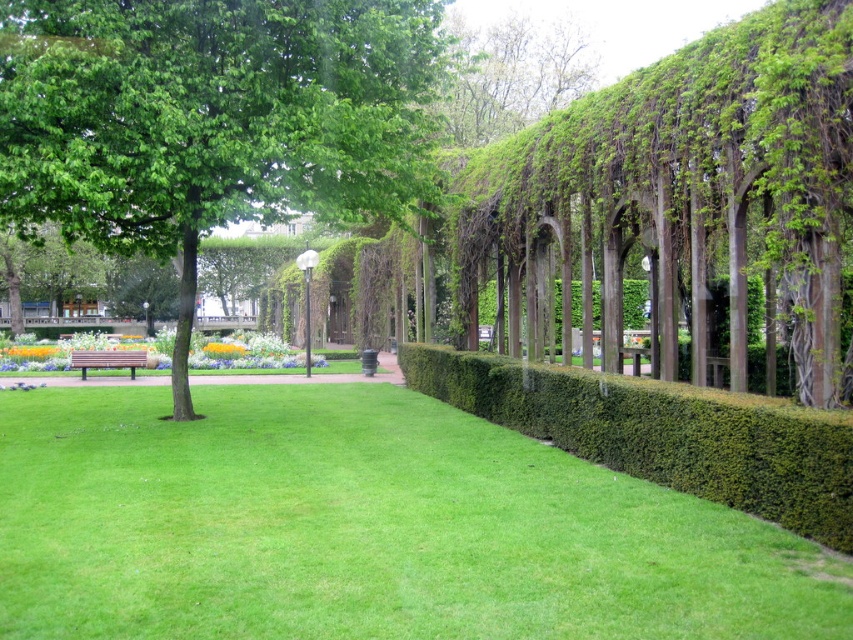
Question: Is green dense hedge at right to the right of yellow matte flower at center from the viewer's perspective?

Choices:
 (A) yes
 (B) no

Answer: (A)

Question: Can you confirm if green grassy at center is positioned to the right of green leafy tree at upper center?

Choices:
 (A) yes
 (B) no

Answer: (B)

Question: Which object appears farthest from the camera in this image?

Choices:
 (A) green grassy at center
 (B) green leafy tree at center
 (C) yellow matte flower at center
 (D) green leafy tree at upper center

Answer: (C)

Question: Which of the following is the closest to the observer?

Choices:
 (A) green leafy tree at center
 (B) green leafy tree at upper center
 (C) green grassy at center

Answer: (C)

Question: Which of the following is the farthest from the observer?

Choices:
 (A) pos(96,353)
 (B) pos(276,202)
 (C) pos(119,509)
 (D) pos(682,458)

Answer: (A)

Question: Does green leafy tree at upper center have a greater width compared to yellow matte flower at center?

Choices:
 (A) no
 (B) yes

Answer: (B)